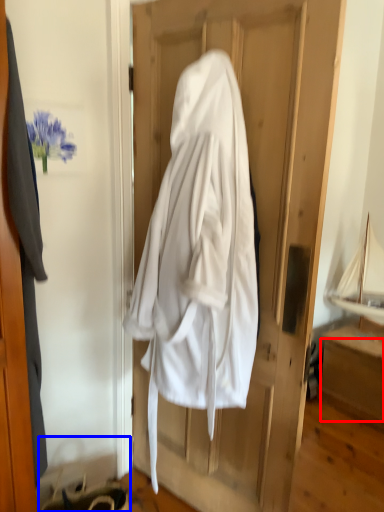
Question: Among these objects, which one is farthest to the camera, drawer (highlighted by a red box) or hanger (highlighted by a blue box)?

Choices:
 (A) drawer
 (B) hanger

Answer: (A)